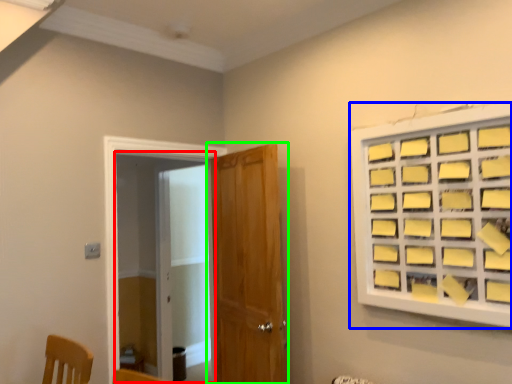
Question: Considering the real-world distances, which object is closest to screen door (highlighted by a red box)? window (highlighted by a blue box) or door (highlighted by a green box).

Choices:
 (A) window
 (B) door

Answer: (B)